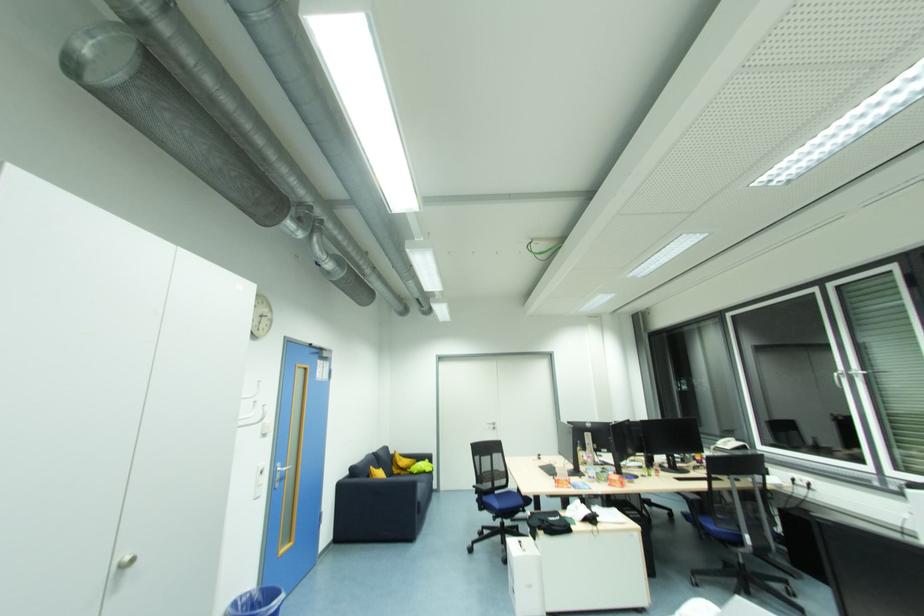
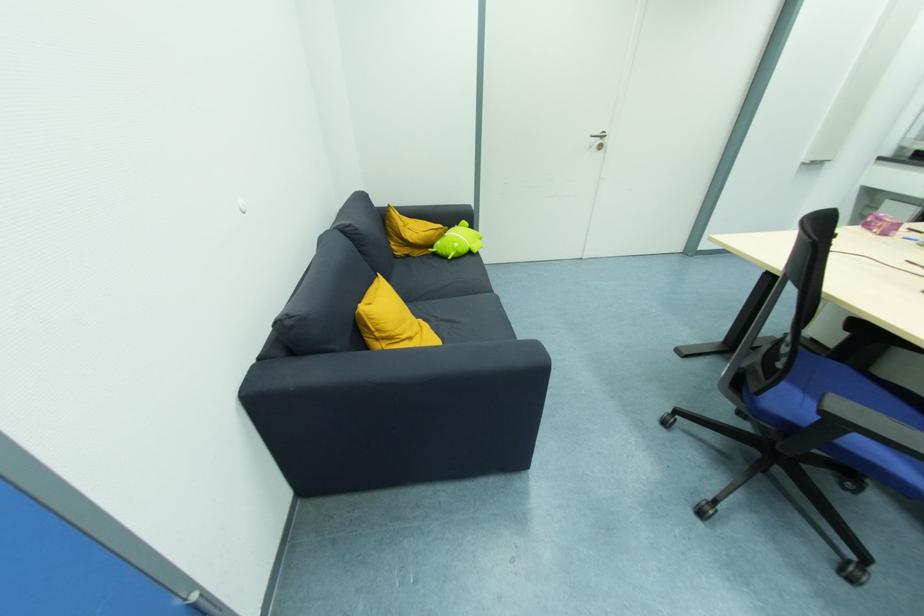
The point at (496,430) is marked in the first image. Where is the corresponding point in the second image?

(603, 148)